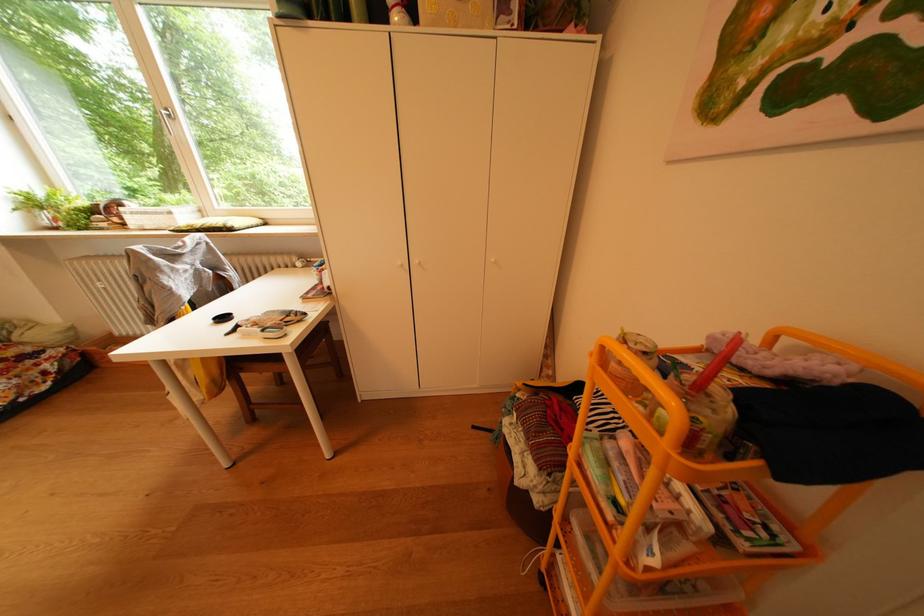
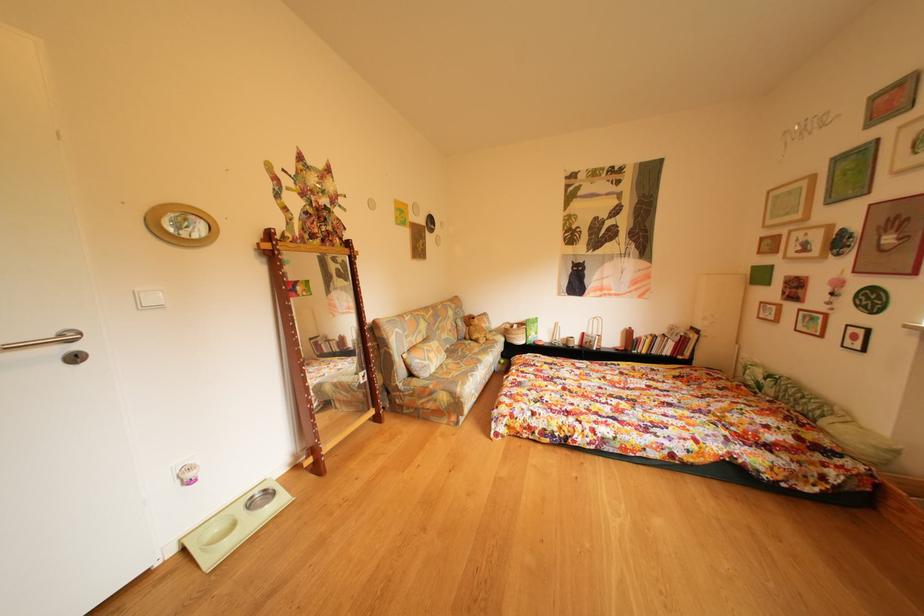
In the scene shown: The first image is from the beginning of the video and the second image is from the end. How did the camera likely rotate when shooting the video?

The camera's rotation is toward left-down.